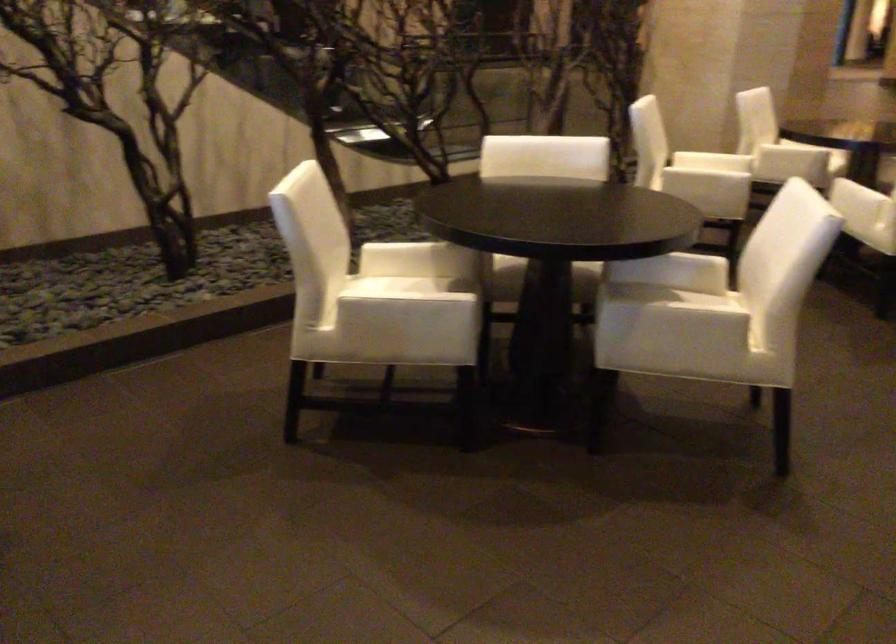
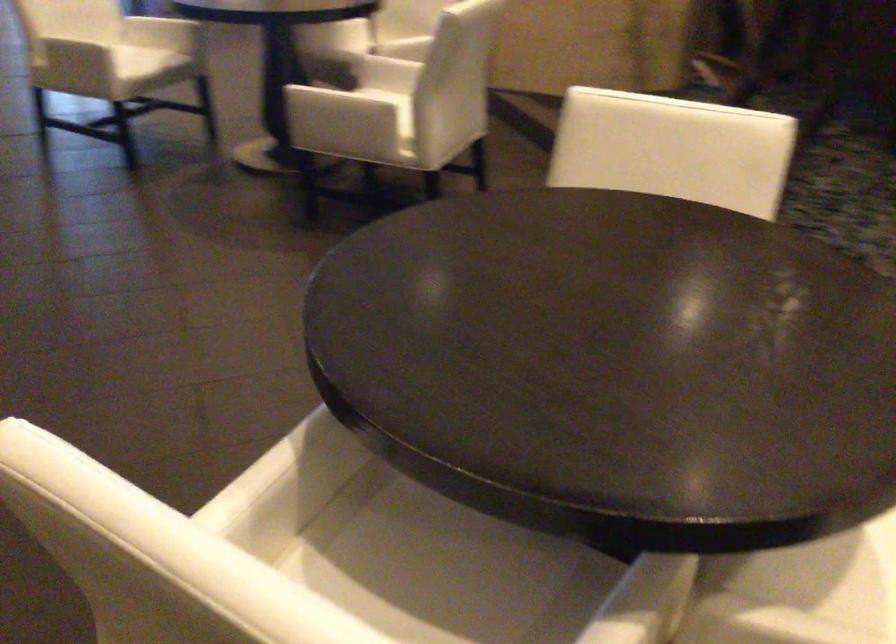
Locate, in the second image, the point that corresponds to the point at 314,205 in the first image.

(673, 149)